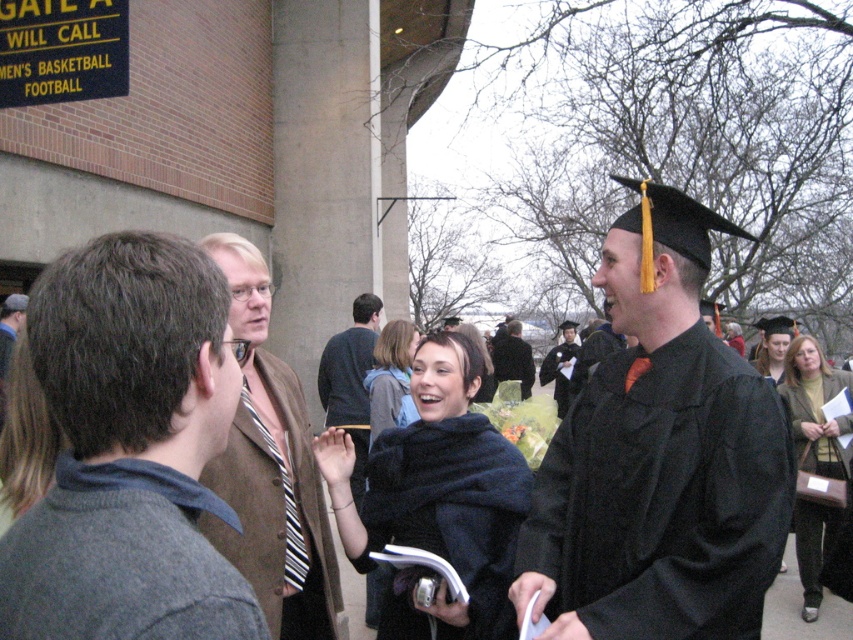
Is matte black graduation gown at right thinner than gray wool sweater at left?

In fact, matte black graduation gown at right might be wider than gray wool sweater at left.

Does matte black graduation gown at right have a larger size compared to gray wool sweater at left?

Indeed, matte black graduation gown at right has a larger size compared to gray wool sweater at left.

Find the location of a particular element. matte black graduation gown at right is located at coordinates (659, 456).

Between dark gray sweater at center and black fuzzy coat at center, which one has less height?

black fuzzy coat at center is shorter.

Who is lower down, dark gray sweater at center or black fuzzy coat at center?

dark gray sweater at center

Who is more distant from viewer, [352,435] or [372,436]?

Point [352,435]

Locate an element on the screen. dark gray sweater at center is located at coordinates 351,381.

Can you confirm if gray wool sweater at left is positioned above matte black graduation gown at center?

Correct, gray wool sweater at left is located above matte black graduation gown at center.

Based on the photo, how far apart are gray wool sweater at left and matte black graduation gown at center?

22.53 feet

Is point (184, 376) closer to viewer compared to point (585, 376)?

Yes, point (184, 376) is in front of point (585, 376).

Locate an element on the screen. This screenshot has width=853, height=640. gray wool sweater at left is located at coordinates tap(128, 449).